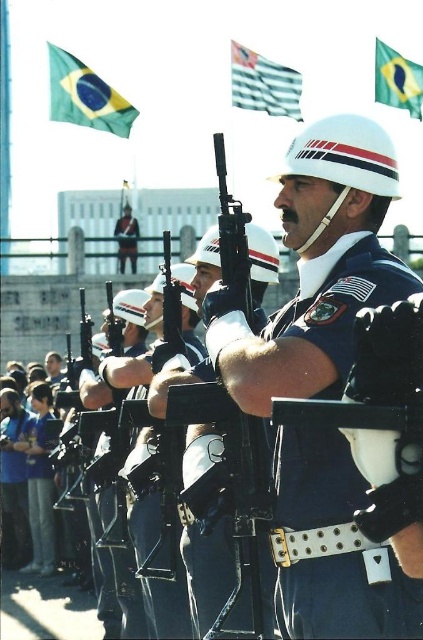
Looking at this image, is blue fabric belt at center to the left of blue fabric uniform at lower left from the viewer's perspective?

No, blue fabric belt at center is not to the left of blue fabric uniform at lower left.

Does blue fabric belt at center have a larger size compared to blue fabric uniform at lower left?

Indeed, blue fabric belt at center has a larger size compared to blue fabric uniform at lower left.

Which is behind, point (397, 577) or point (7, 488)?

The point (7, 488) is more distant.

Find the location of a particular element. Image resolution: width=423 pixels, height=640 pixels. blue fabric belt at center is located at coordinates (332, 547).

Consider the image. Does blue fabric belt at center appear under green fabric flag at upper left?

Indeed, blue fabric belt at center is positioned under green fabric flag at upper left.

Which is behind, point (362, 570) or point (52, 61)?

Positioned behind is point (52, 61).

Which is behind, point (310, 289) or point (109, 109)?

Point (109, 109)

In order to click on blue fabric belt at center in this screenshot , I will do `click(332, 547)`.

Between point (38, 508) and point (131, 212), which one is positioned behind?

The point (131, 212) is behind.

Is blue fabric shirt at lower left behind white matte helmet at upper center?

That is False.

Between point (30, 524) and point (123, 232), which one is positioned behind?

Point (123, 232)

Image resolution: width=423 pixels, height=640 pixels. Find the location of `blue fabric shirt at lower left`. blue fabric shirt at lower left is located at coordinates (41, 490).